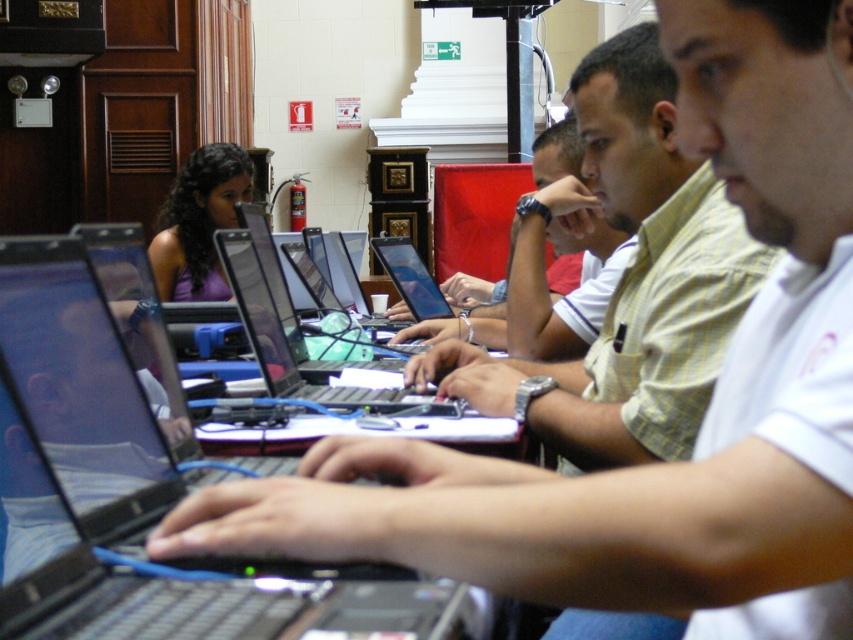
You are a person standing in front of the long table where the group is working. You need to reach the light yellow shirt at center to hand them a document. Can you comfortably extend your arm to reach them without moving your position?

The light yellow shirt at center is 1.33 meters away from the viewer. Since the average arm length is about 0.7 meters, you cannot comfortably reach them without moving closer.

In the scene described, where is the light yellow shirt at center located in terms of coordinates?

The light yellow shirt at center is located at point coordinates of [630,284].